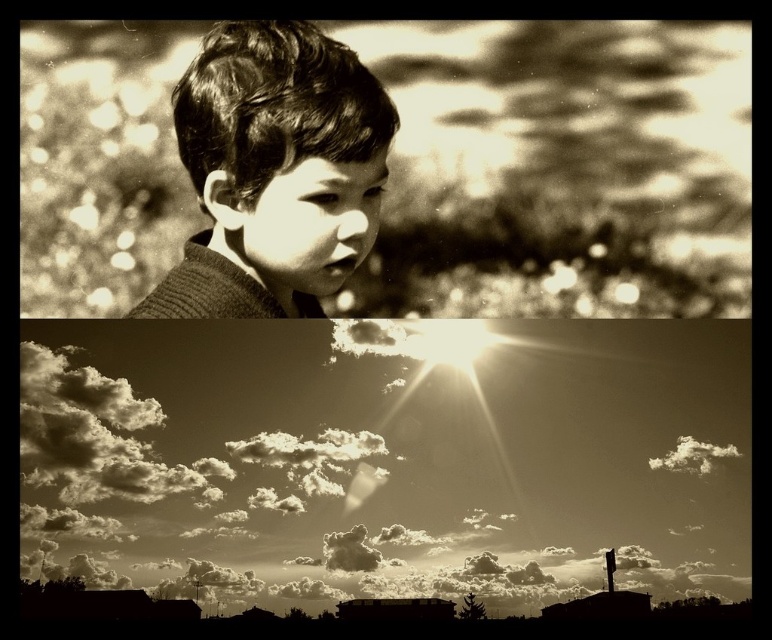
Question: Estimate the real-world distances between objects in this image. Which object is closer to the cloudy sky at upper center?

Choices:
 (A) matte black hair at upper center
 (B) fuzzy white cloud at upper center

Answer: (B)

Question: Can you confirm if cloudy sky at upper center is positioned to the left of fuzzy white cloud at upper center?

Choices:
 (A) yes
 (B) no

Answer: (A)

Question: Which object is positioned closest to the fuzzy white cloud at upper center?

Choices:
 (A) cloudy sky at upper center
 (B) matte black hair at upper center

Answer: (A)

Question: Where is cloudy sky at upper center located in relation to matte black hair at upper center in the image?

Choices:
 (A) below
 (B) above

Answer: (A)

Question: Which object is positioned closest to the fuzzy white cloud at upper center?

Choices:
 (A) matte black hair at upper center
 (B) cloudy sky at upper center

Answer: (B)

Question: Does cloudy sky at upper center appear on the right side of matte black hair at upper center?

Choices:
 (A) no
 (B) yes

Answer: (B)